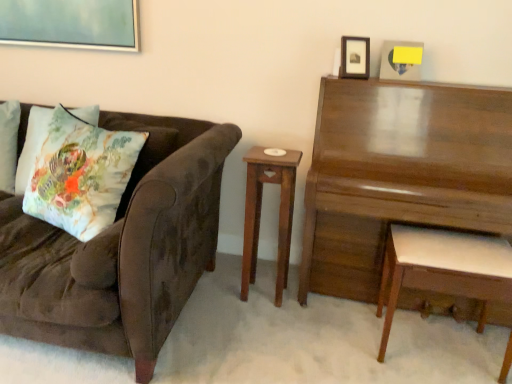
Find the location of a particular element. The image size is (512, 384). free area in between wooden nightstand at center and white wood stool at right is located at coordinates (331, 320).